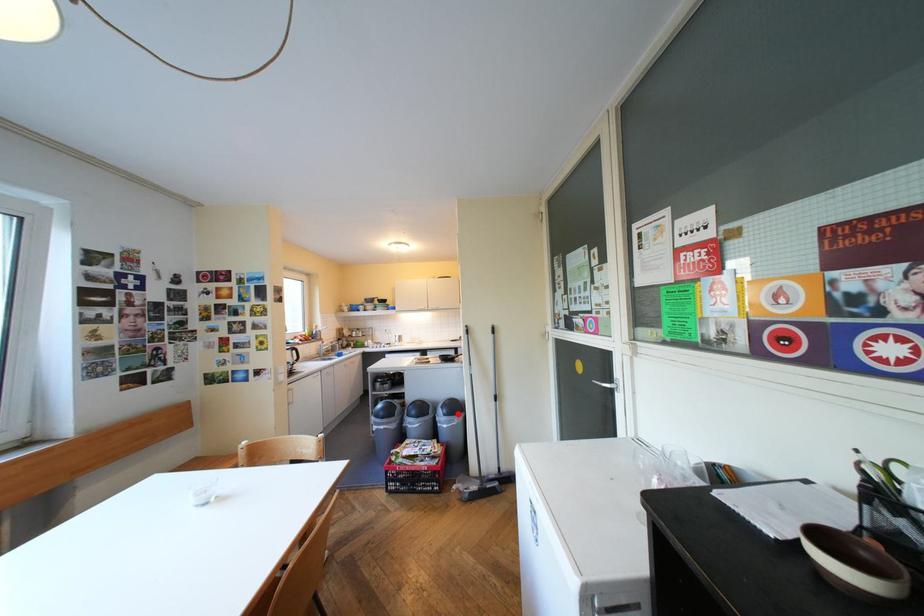
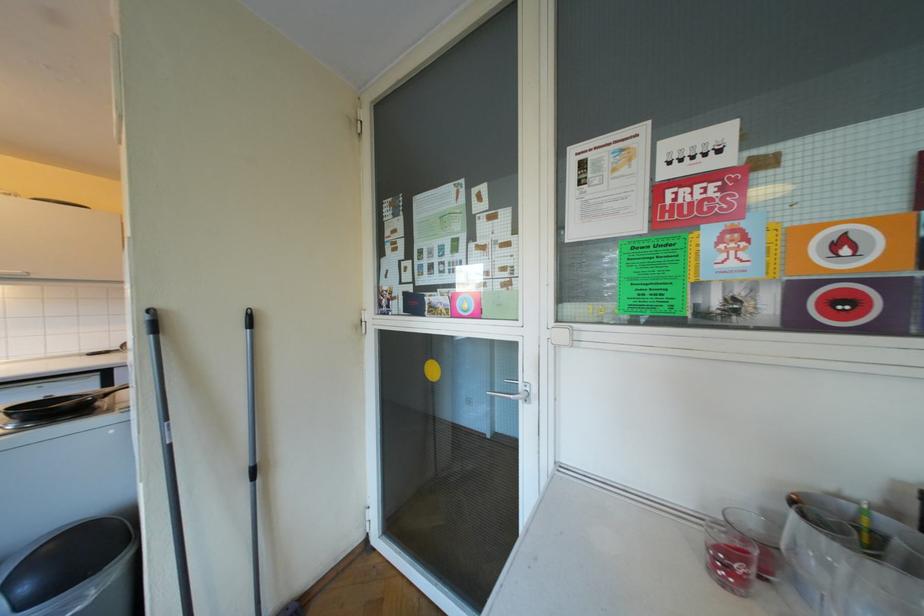
Question: A red point is marked in image1. In image2, is the corresponding 3D point closer to the camera or farther? Reply with the corresponding letter.

Choices:
 (A) The corresponding 3D point is closer.
 (B) The corresponding 3D point is farther.

Answer: (A)